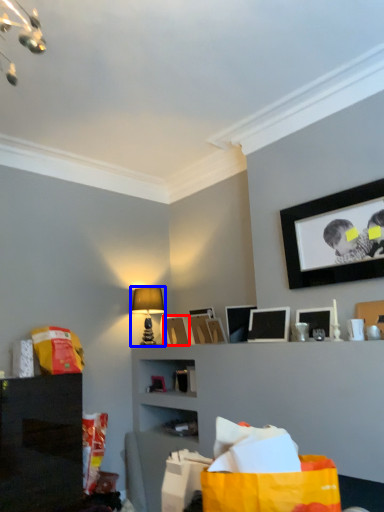
Question: Which object is further to the camera taking this photo, picture frame (highlighted by a red box) or table lamp (highlighted by a blue box)?

Choices:
 (A) picture frame
 (B) table lamp

Answer: (B)